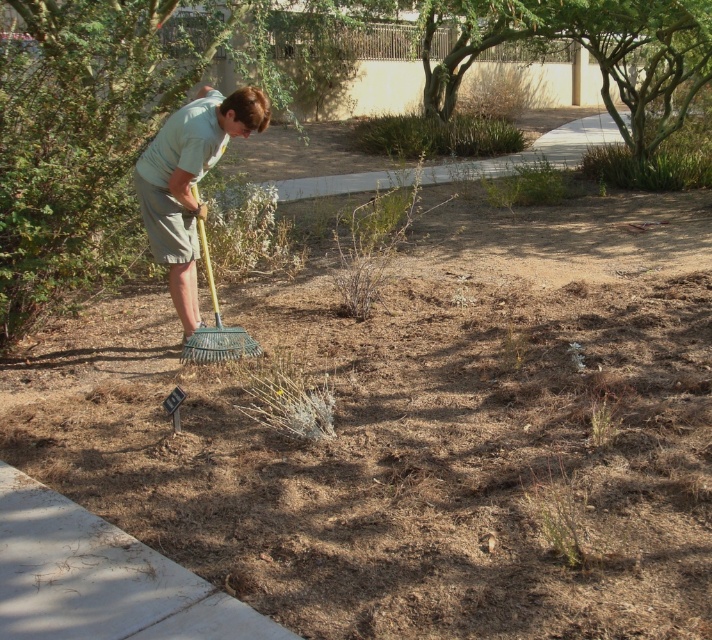
Who is higher up, light green fabric at upper left or metallic green rake at center?

Positioned higher is light green fabric at upper left.

Between light green fabric at upper left and metallic green rake at center, which one appears on the left side from the viewer's perspective?

From the viewer's perspective, light green fabric at upper left appears more on the left side.

Is point (177, 205) positioned before point (216, 323)?

Yes.

You are a GUI agent. You are given a task and a screenshot of the screen. Output one action in this format:
    pyautogui.click(x=<x>, y=<y>)
    Task: Click on the light green fabric at upper left
    This screenshot has height=640, width=712.
    Given the screenshot: What is the action you would take?
    pyautogui.click(x=189, y=180)